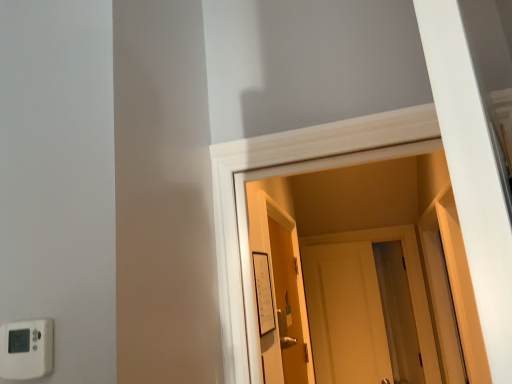
Question: From the image's perspective, relative to wooden door at center, marked as the 1th door in a left-to-right arrangement, is white paper at center, the 2th light switch in the left-to-right sequence, above or below?

Choices:
 (A) below
 (B) above

Answer: (B)

Question: Is white paper at center, the 2th light switch in the left-to-right sequence, inside or outside of wooden door at center, placed as the second door when sorted from back to front?

Choices:
 (A) inside
 (B) outside

Answer: (B)

Question: Estimate the real-world distances between objects in this image. Which object is closer to the wooden door at center, the second door positioned from the right?

Choices:
 (A) white matte door at center, which is the 1th door from back to front
 (B) white plastic thermostat at lower left, the second light switch positioned from the back
 (C) white paper at center, the 2th light switch in the left-to-right sequence

Answer: (C)

Question: Estimate the real-world distances between objects in this image. Which object is farther from the white plastic thermostat at lower left, the second light switch in the right-to-left sequence?

Choices:
 (A) wooden door at center, positioned as the 1th door in front-to-back order
 (B) white paper at center, which is counted as the 2th light switch, starting from the front
 (C) white matte door at center, acting as the 2th door starting from the left

Answer: (C)